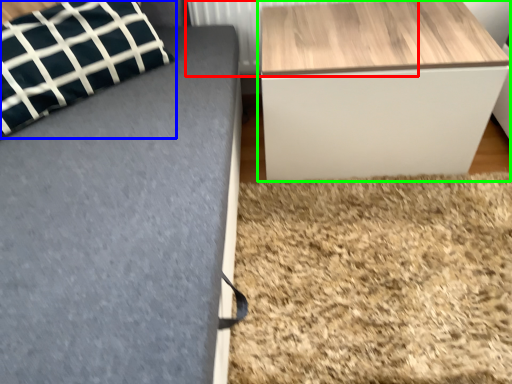
Question: Which object is positioned closest to radiator (highlighted by a red box)? Select from pillow (highlighted by a blue box) and table (highlighted by a green box).

Choices:
 (A) pillow
 (B) table

Answer: (B)